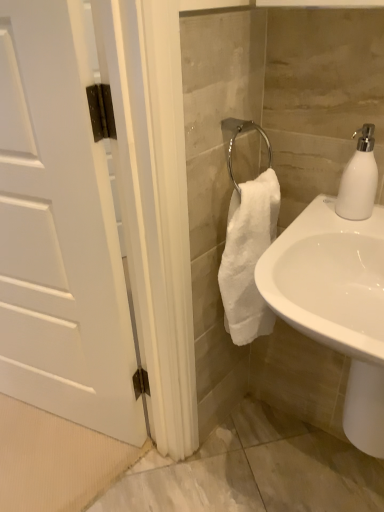
Question: Considering their positions, is white glossy sink at lower right located in front of or behind white matte door at left?

Choices:
 (A) behind
 (B) front

Answer: (B)

Question: From the image's perspective, is white glossy sink at lower right above or below white matte door at left?

Choices:
 (A) below
 (B) above

Answer: (A)

Question: Based on their relative distances, which object is farther from the white matte door at left?

Choices:
 (A) white glossy sink at lower right
 (B) white matte soap dispenser at upper right

Answer: (B)

Question: Based on their relative distances, which object is farther from the white matte door at left?

Choices:
 (A) white glossy sink at lower right
 (B) white matte soap dispenser at upper right

Answer: (B)